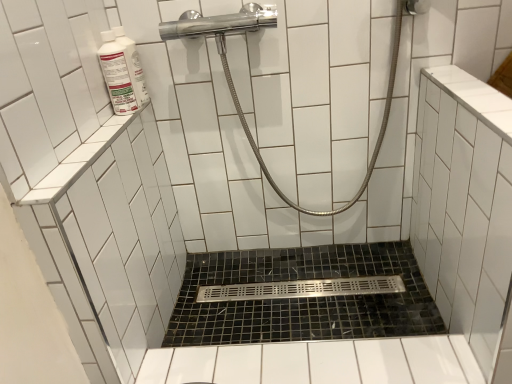
Question: Is black mosaic tile bath at center looking in the opposite direction of white glossy bottle at upper left, the 1th cleaning product positioned from the back?

Choices:
 (A) no
 (B) yes

Answer: (A)

Question: Does black mosaic tile bath at center appear on the right side of white glossy bottle at upper left, which is the 2th cleaning product from front to back?

Choices:
 (A) no
 (B) yes

Answer: (B)

Question: Can we say black mosaic tile bath at center lies outside white glossy bottle at upper left, the 1th cleaning product positioned from the back?

Choices:
 (A) yes
 (B) no

Answer: (A)

Question: Is the depth of black mosaic tile bath at center less than that of white glossy bottle at upper left, the 1th cleaning product positioned from the back?

Choices:
 (A) no
 (B) yes

Answer: (A)

Question: From a real-world perspective, is black mosaic tile bath at center below white glossy bottle at upper left, which is the 2th cleaning product from front to back?

Choices:
 (A) no
 (B) yes

Answer: (B)

Question: Considering their positions, is black mosaic tile bath at center located in front of or behind polished chrome showerhead at upper center?

Choices:
 (A) behind
 (B) front

Answer: (A)

Question: Considering the relative positions of black mosaic tile bath at center and polished chrome showerhead at upper center in the image provided, is black mosaic tile bath at center to the left or to the right of polished chrome showerhead at upper center?

Choices:
 (A) left
 (B) right

Answer: (B)

Question: Looking at the image, does black mosaic tile bath at center seem bigger or smaller compared to polished chrome showerhead at upper center?

Choices:
 (A) big
 (B) small

Answer: (B)

Question: From a real-world perspective, is black mosaic tile bath at center above or below polished chrome showerhead at upper center?

Choices:
 (A) above
 (B) below

Answer: (B)

Question: Which is correct: white glossy bottle at upper left, arranged as the second cleaning product when viewed from the back, is inside polished chrome showerhead at upper center, or outside of it?

Choices:
 (A) outside
 (B) inside

Answer: (A)

Question: Is white glossy bottle at upper left, arranged as the second cleaning product when viewed from the back, wider or thinner than polished chrome showerhead at upper center?

Choices:
 (A) wide
 (B) thin

Answer: (B)

Question: From the image's perspective, relative to polished chrome showerhead at upper center, is white glossy bottle at upper left, the first cleaning product from the front, above or below?

Choices:
 (A) below
 (B) above

Answer: (B)

Question: Looking at the image, does white glossy bottle at upper left, the first cleaning product from the front, seem bigger or smaller compared to polished chrome showerhead at upper center?

Choices:
 (A) small
 (B) big

Answer: (A)

Question: Is polished chrome showerhead at upper center wider or thinner than white glossy bottle at upper left, the 1th cleaning product positioned from the back?

Choices:
 (A) thin
 (B) wide

Answer: (B)

Question: From a real-world perspective, relative to white glossy bottle at upper left, the 1th cleaning product positioned from the back, is polished chrome showerhead at upper center vertically above or below?

Choices:
 (A) above
 (B) below

Answer: (B)